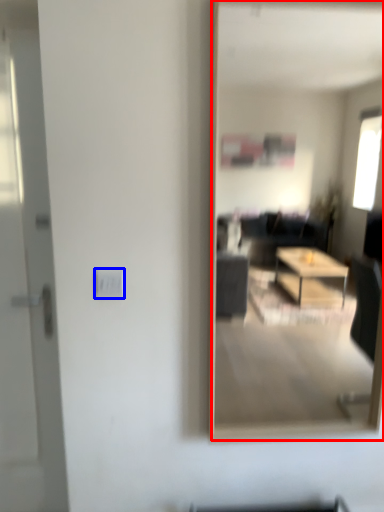
Question: Which point is further to the camera, mirror (highlighted by a red box) or electric outlet (highlighted by a blue box)?

Choices:
 (A) mirror
 (B) electric outlet

Answer: (B)